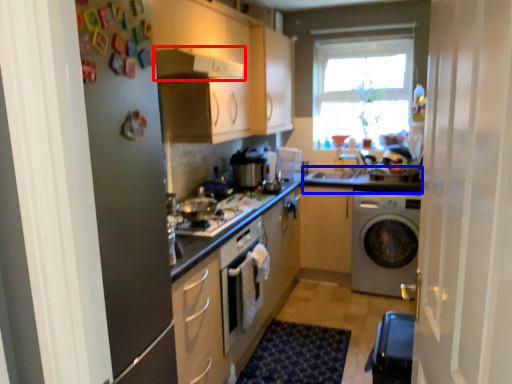
Question: Among these objects, which one is farthest to the camera, exhaust hood (highlighted by a red box) or counter top (highlighted by a blue box)?

Choices:
 (A) exhaust hood
 (B) counter top

Answer: (B)